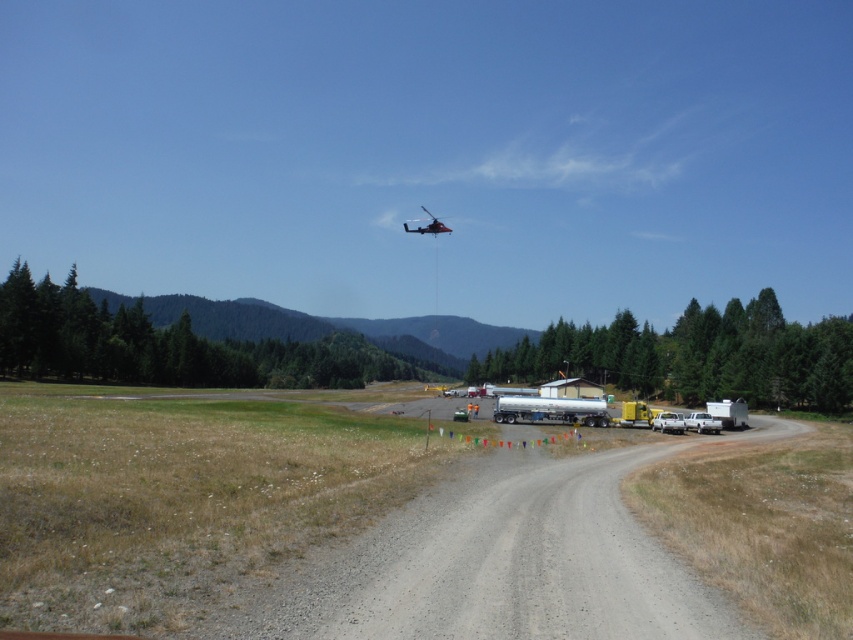
You are standing at the dirt road in the rural scene. You notice two points marked in the image. Which point, point (633, 572) or point (518, 413), is closer to you?

Point (633, 572) is closer to the viewer than point (518, 413).

You are a delivery driver who needs to turn your silver metallic trailer truck at center around on the gray gravel road at center. Based on the scene, can you fit the truck within the road width while making the turn?

The gray gravel road at center is bigger than the silver metallic trailer truck at center, so yes, the truck can fit within the road width while making the turn.